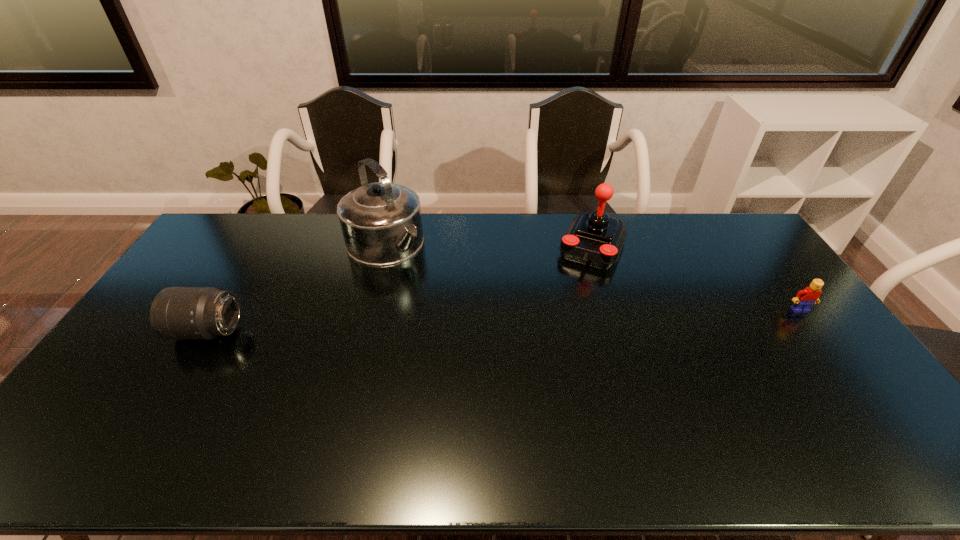
The height and width of the screenshot is (540, 960). Identify the location of vacant space at the far edge of the desktop. (339, 219).

In the image, there is a desktop. In order to click on free space at the near edge in this screenshot , I will do `click(569, 416)`.

I want to click on vacant space at the right edge of the desktop, so click(776, 332).

Locate an element on the screen. This screenshot has height=540, width=960. free location at the far left corner is located at coordinates (215, 233).

In the image, there is a desktop. What are the coordinates of `blank space at the near left corner` in the screenshot? It's located at (94, 404).

Where is `free space at the far right corner of the desktop`? free space at the far right corner of the desktop is located at coordinates (723, 222).

Locate an element on the screen. The height and width of the screenshot is (540, 960). empty space that is in between the kettle and the shortest object is located at coordinates (592, 277).

Where is `free space between the telephoto lens and the tallest object`? The width and height of the screenshot is (960, 540). free space between the telephoto lens and the tallest object is located at coordinates (298, 288).

In order to click on free space that is in between the second object from right to left and the tallest object in this screenshot , I will do `click(489, 245)`.

The width and height of the screenshot is (960, 540). What are the coordinates of `free space that is in between the rightmost object and the joystick` in the screenshot? It's located at (x=696, y=278).